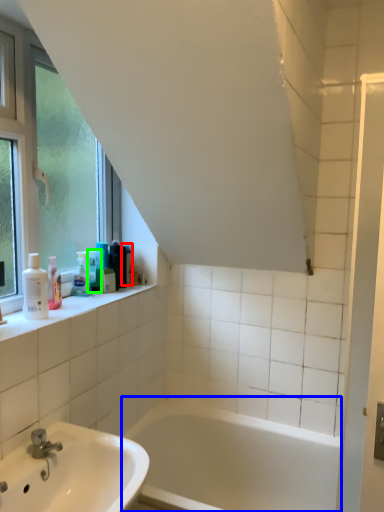
Question: Which object is positioned closest to toiletry (highlighted by a red box)? Select from bathtub (highlighted by a blue box) and toiletry (highlighted by a green box).

Choices:
 (A) bathtub
 (B) toiletry

Answer: (B)